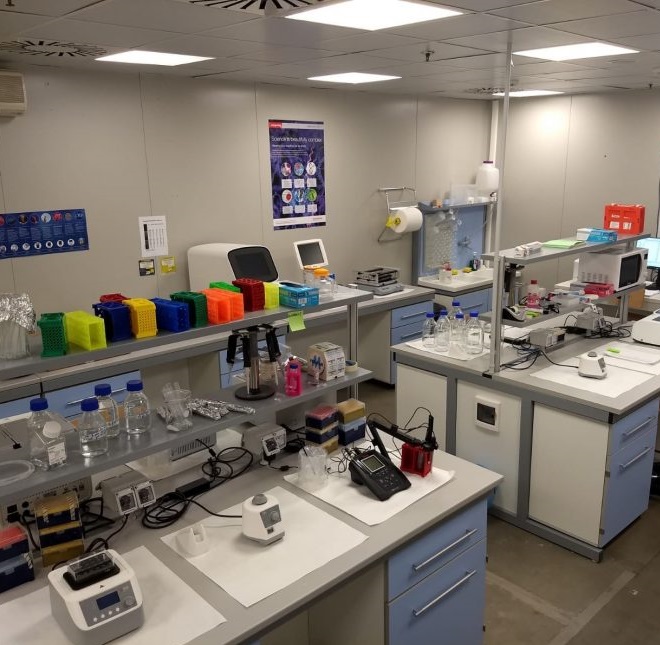
Find the location of a particular element. walls is located at coordinates (226, 184), (572, 146).